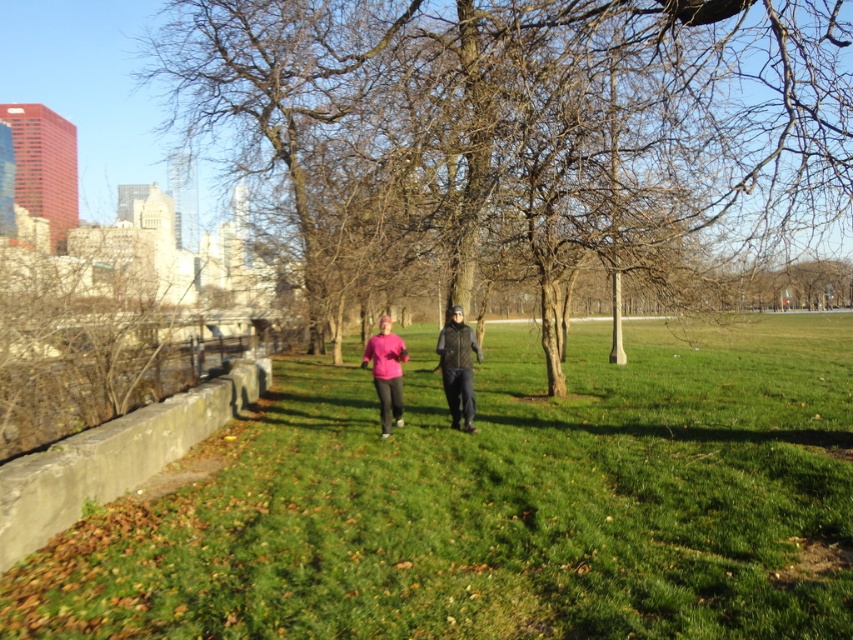
Can you confirm if brown/dry bark tree at center is positioned above dark green quilted vest at center?

Yes, brown/dry bark tree at center is above dark green quilted vest at center.

Is brown/dry bark tree at center thinner than dark green quilted vest at center?

In fact, brown/dry bark tree at center might be wider than dark green quilted vest at center.

At what (x,y) coordinates should I click in order to perform the action: click on brown/dry bark tree at center. Please return your answer as a coordinate pair (x, y). The height and width of the screenshot is (640, 853). Looking at the image, I should click on (517, 131).

Is green grassy at center to the left of pink matte shirt at center from the viewer's perspective?

Incorrect, green grassy at center is not on the left side of pink matte shirt at center.

Can you confirm if green grassy at center is bigger than pink matte shirt at center?

Indeed, green grassy at center has a larger size compared to pink matte shirt at center.

Which is in front, point (589, 480) or point (397, 406)?

Point (589, 480) is more forward.

Find the location of a particular element. This screenshot has height=640, width=853. green grassy at center is located at coordinates (494, 502).

Is dark green quilted vest at center below pink matte shirt at center?

No, dark green quilted vest at center is not below pink matte shirt at center.

Which is in front, point (448, 387) or point (401, 380)?

Point (448, 387)

This screenshot has height=640, width=853. Find the location of `dark green quilted vest at center`. dark green quilted vest at center is located at coordinates (457, 368).